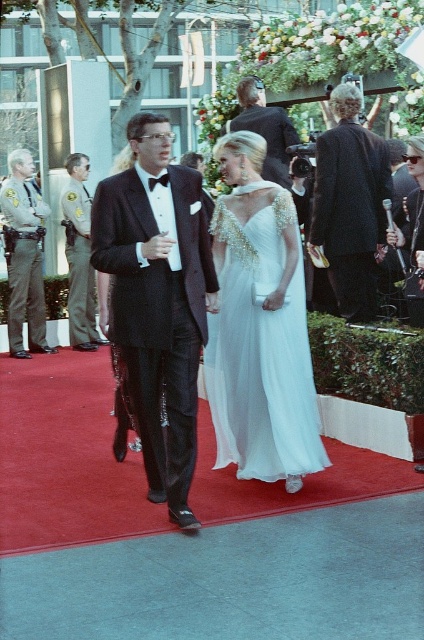
Looking at this image, you are standing at the point marked as point (335, 228) in the image, which is 6.54 meters away from the camera. You want to take a photo of the man in the black tuxedo and the woman in the white gown walking together. Would you need to zoom in or zoom out to include both of them in the frame?

Since the distance of point (335, 228) from the camera is 6.54 meters, you would need to zoom out to include both the man in the black tuxedo and the woman in the white gown walking together in the frame.

You are standing at the back of the event venue and want to take a photo of the two points mentioned in the scene. Which point, point (44,340) or point (262,168), will appear closer to the camera in your photo?

Point (44,340) is further to the camera than point (262,168), so it will appear closer to the camera in the photo.